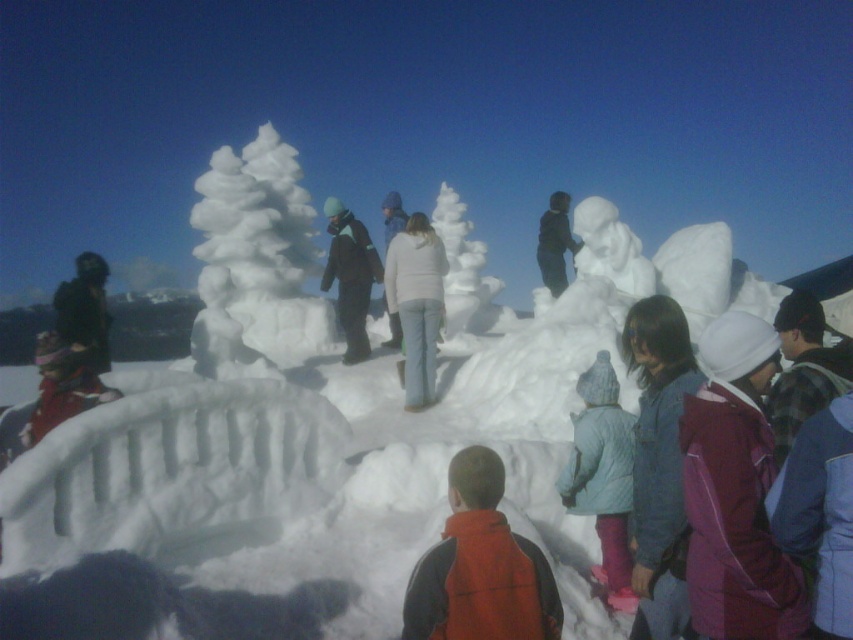
Does dark blue jacket at center appear over white frosty snowman at center?

No.

Locate an element on the screen. This screenshot has width=853, height=640. dark blue jacket at center is located at coordinates (350, 275).

Who is taller, dark blue jacket at center or black matte snowman at center?

black matte snowman at center is taller.

Between dark blue jacket at center and black matte snowman at center, which one appears on the left side from the viewer's perspective?

dark blue jacket at center

At what (x,y) coordinates should I click in order to perform the action: click on dark blue jacket at center. Please return your answer as a coordinate pair (x, y). Looking at the image, I should click on (350, 275).

What do you see at coordinates (257, 256) in the screenshot?
I see `white frosty tree at center` at bounding box center [257, 256].

Is white frosty tree at center wider than orange fleece vest at center?

Yes.

Which is in front, point (277, 356) or point (485, 474)?

Point (485, 474)

You are a GUI agent. You are given a task and a screenshot of the screen. Output one action in this format:
    pyautogui.click(x=<x>, y=<y>)
    Task: Click on the white frosty tree at center
    Image resolution: width=853 pixels, height=640 pixels.
    Given the screenshot: What is the action you would take?
    pyautogui.click(x=257, y=256)